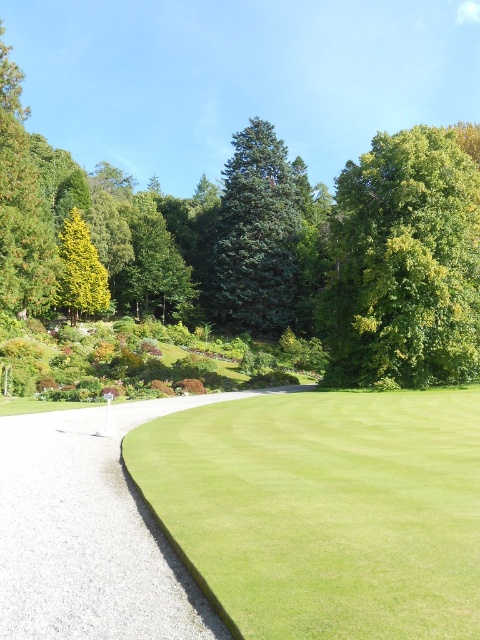
You are standing at the center of the garden and see the point labeled as point (90, 531). Based on the garden layout, is this point likely located on the gravelly path at lower left?

Yes, the point (90, 531) indicates the gravelly path at lower left, so it is located there.